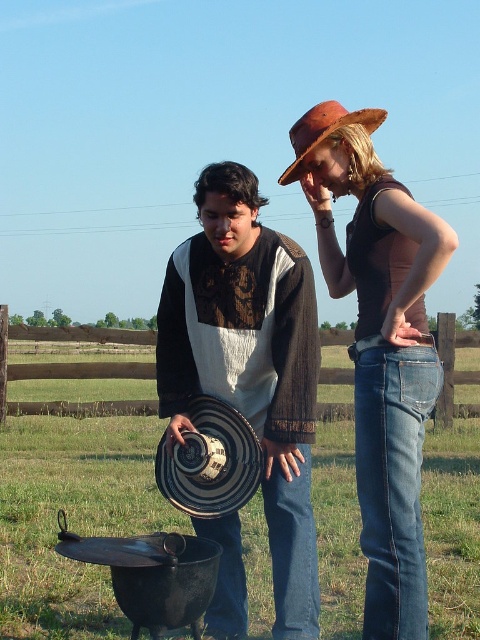
Question: Which point is closer to the camera?

Choices:
 (A) (440, 228)
 (B) (336, 109)

Answer: (A)

Question: Observing the image, what is the correct spatial positioning of striped straw hat at center in reference to brown straw hat at upper center?

Choices:
 (A) below
 (B) above

Answer: (A)

Question: Estimate the real-world distances between objects in this image. Which object is closer to the brown straw hat at upper center?

Choices:
 (A) denim jeans at center
 (B) striped straw hat at center

Answer: (B)

Question: Which point is closer to the camera?

Choices:
 (A) denim jeans at center
 (B) brown straw hat at upper center
 (C) striped straw hat at center

Answer: (A)

Question: Can you confirm if striped straw hat at center is bigger than brown straw hat at upper center?

Choices:
 (A) no
 (B) yes

Answer: (A)

Question: Is striped straw hat at center above denim jeans at center?

Choices:
 (A) no
 (B) yes

Answer: (A)